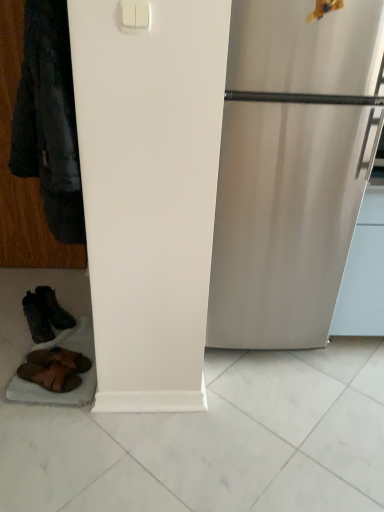
Where is `brown leather sandals at lower left, which ranks as the third footwear in back-to-front order`? The height and width of the screenshot is (512, 384). brown leather sandals at lower left, which ranks as the third footwear in back-to-front order is located at coordinates (50, 376).

Describe the element at coordinates (45, 314) in the screenshot. The height and width of the screenshot is (512, 384). I see `dark brown leather boots at lower left, the 1th footwear viewed from the back` at that location.

Locate an element on the screen. The width and height of the screenshot is (384, 512). brown leather sandals at lower left, which ranks as the second footwear in back-to-front order is located at coordinates (60, 359).

Locate an element on the screen. white plastic light switch at upper center is located at coordinates (135, 14).

Is brown leather sandals at lower left, placed as the first footwear when sorted from front to back, bigger than brown leather sandals at lower left, which ranks as the second footwear in back-to-front order?

Indeed, brown leather sandals at lower left, placed as the first footwear when sorted from front to back, has a larger size compared to brown leather sandals at lower left, which ranks as the second footwear in back-to-front order.

Is brown leather sandals at lower left, placed as the first footwear when sorted from front to back, far from brown leather sandals at lower left, the second footwear from the front?

No, brown leather sandals at lower left, placed as the first footwear when sorted from front to back, is in close proximity to brown leather sandals at lower left, the second footwear from the front.

Which is in front, point (21, 369) or point (43, 354)?

Point (21, 369)

From the image's perspective, relative to brown leather sandals at lower left, the second footwear from the front, is brown leather sandals at lower left, which ranks as the third footwear in back-to-front order, above or below?

Based on their image positions, brown leather sandals at lower left, which ranks as the third footwear in back-to-front order, is located beneath brown leather sandals at lower left, the second footwear from the front.

Does brown leather sandals at lower left, the second footwear from the front, have a lesser width compared to brown leather sandals at lower left, placed as the first footwear when sorted from front to back?

Yes, brown leather sandals at lower left, the second footwear from the front, is thinner than brown leather sandals at lower left, placed as the first footwear when sorted from front to back.

Considering their positions, is brown leather sandals at lower left, which ranks as the second footwear in back-to-front order, located in front of or behind brown leather sandals at lower left, which ranks as the third footwear in back-to-front order?

brown leather sandals at lower left, which ranks as the second footwear in back-to-front order, is positioned farther from the viewer than brown leather sandals at lower left, which ranks as the third footwear in back-to-front order.

Is brown leather sandals at lower left, which ranks as the second footwear in back-to-front order, not inside brown leather sandals at lower left, placed as the first footwear when sorted from front to back?

Absolutely, brown leather sandals at lower left, which ranks as the second footwear in back-to-front order, is external to brown leather sandals at lower left, placed as the first footwear when sorted from front to back.

Is brown leather sandals at lower left, the second footwear from the front, oriented towards brown leather sandals at lower left, which ranks as the third footwear in back-to-front order?

No, brown leather sandals at lower left, the second footwear from the front, is not oriented towards brown leather sandals at lower left, which ranks as the third footwear in back-to-front order.

Considering the relative positions of white plastic light switch at upper center and brown leather sandals at lower left, which ranks as the third footwear in back-to-front order, in the image provided, is white plastic light switch at upper center to the right of brown leather sandals at lower left, which ranks as the third footwear in back-to-front order, from the viewer's perspective?

Yes, white plastic light switch at upper center is to the right of brown leather sandals at lower left, which ranks as the third footwear in back-to-front order.

From the image's perspective, is white plastic light switch at upper center positioned above or below brown leather sandals at lower left, placed as the first footwear when sorted from front to back?

From the image's perspective, white plastic light switch at upper center appears above brown leather sandals at lower left, placed as the first footwear when sorted from front to back.

I want to click on light switch above the brown leather sandals at lower left, which ranks as the third footwear in back-to-front order (from the image's perspective), so click(135, 14).

Can brown leather sandals at lower left, which ranks as the third footwear in back-to-front order, be found inside white plastic light switch at upper center?

That's incorrect, brown leather sandals at lower left, which ranks as the third footwear in back-to-front order, is not inside white plastic light switch at upper center.

Would you consider white plastic light switch at upper center to be distant from brown leather sandals at lower left, the second footwear from the front?

Indeed, white plastic light switch at upper center is not near brown leather sandals at lower left, the second footwear from the front.

Does point (137, 11) come farther from viewer compared to point (57, 354)?

No, it is in front of (57, 354).

Is white plastic light switch at upper center oriented towards brown leather sandals at lower left, which ranks as the second footwear in back-to-front order?

No, white plastic light switch at upper center is not aimed at brown leather sandals at lower left, which ranks as the second footwear in back-to-front order.

Can you tell me how much white plastic light switch at upper center and brown leather sandals at lower left, which ranks as the second footwear in back-to-front order, differ in facing direction?

white plastic light switch at upper center and brown leather sandals at lower left, which ranks as the second footwear in back-to-front order, are facing 106 degrees away from each other.

Would you say dark brown leather boots at lower left, the 1th footwear viewed from the back, is outside brown leather sandals at lower left, placed as the first footwear when sorted from front to back?

That's correct, dark brown leather boots at lower left, the 1th footwear viewed from the back, is outside of brown leather sandals at lower left, placed as the first footwear when sorted from front to back.

Would you say dark brown leather boots at lower left, the 1th footwear viewed from the back, is a long distance from brown leather sandals at lower left, which ranks as the third footwear in back-to-front order?

No, dark brown leather boots at lower left, the 1th footwear viewed from the back, is not far from brown leather sandals at lower left, which ranks as the third footwear in back-to-front order.

How different are the orientations of dark brown leather boots at lower left, the 3th footwear from the front, and brown leather sandals at lower left, which ranks as the third footwear in back-to-front order, in degrees?

26.4 degrees.

From the image's perspective, which is below, dark brown leather boots at lower left, the 3th footwear from the front, or brown leather sandals at lower left, placed as the first footwear when sorted from front to back?

From the image's view, brown leather sandals at lower left, placed as the first footwear when sorted from front to back, is below.

In the scene shown: Considering the sizes of white plastic light switch at upper center and dark brown leather boots at lower left, the 1th footwear viewed from the back, in the image, is white plastic light switch at upper center taller or shorter than dark brown leather boots at lower left, the 1th footwear viewed from the back,?

white plastic light switch at upper center is shorter than dark brown leather boots at lower left, the 1th footwear viewed from the back.

Starting from the white plastic light switch at upper center, which footwear is the 3rd one to the left? Please provide its 2D coordinates.

[(45, 314)]

Is dark brown leather boots at lower left, the 3th footwear from the front, not near brown leather sandals at lower left, the second footwear from the front?

No.

Is dark brown leather boots at lower left, the 1th footwear viewed from the back, not within brown leather sandals at lower left, which ranks as the second footwear in back-to-front order?

Indeed, dark brown leather boots at lower left, the 1th footwear viewed from the back, is completely outside brown leather sandals at lower left, which ranks as the second footwear in back-to-front order.

Looking at their sizes, would you say dark brown leather boots at lower left, the 3th footwear from the front, is wider or thinner than brown leather sandals at lower left, the second footwear from the front?

dark brown leather boots at lower left, the 3th footwear from the front, is thinner than brown leather sandals at lower left, the second footwear from the front.

This screenshot has width=384, height=512. There is a brown leather sandals at lower left, placed as the first footwear when sorted from front to back. What are the coordinates of `the 1st footwear above it (from the image's perspective)` in the screenshot? It's located at [x=60, y=359].

Starting from the brown leather sandals at lower left, which ranks as the third footwear in back-to-front order, which footwear is the 1st one behind? Please provide its 2D coordinates.

[(60, 359)]

Which object lies nearer to the anchor point brown leather sandals at lower left, the second footwear from the front, dark brown leather boots at lower left, the 3th footwear from the front, or brown leather sandals at lower left, placed as the first footwear when sorted from front to back?

brown leather sandals at lower left, placed as the first footwear when sorted from front to back, is positioned closer to the anchor brown leather sandals at lower left, the second footwear from the front.

Which object lies further to the anchor point dark brown leather boots at lower left, the 1th footwear viewed from the back, brown leather sandals at lower left, which ranks as the third footwear in back-to-front order, or brown leather sandals at lower left, the second footwear from the front?

Among the two, brown leather sandals at lower left, which ranks as the third footwear in back-to-front order, is located further to dark brown leather boots at lower left, the 1th footwear viewed from the back.

When comparing their distances from white plastic light switch at upper center, does brown leather sandals at lower left, which ranks as the third footwear in back-to-front order, or dark brown leather boots at lower left, the 3th footwear from the front, seem further?

dark brown leather boots at lower left, the 3th footwear from the front, is further to white plastic light switch at upper center.

From the image, which object appears to be nearer to brown leather sandals at lower left, the second footwear from the front, white plastic light switch at upper center or dark brown leather boots at lower left, the 1th footwear viewed from the back?

dark brown leather boots at lower left, the 1th footwear viewed from the back, lies closer to brown leather sandals at lower left, the second footwear from the front, than the other object.

From the image, which object appears to be nearer to white plastic light switch at upper center, dark brown leather boots at lower left, the 1th footwear viewed from the back, or brown leather sandals at lower left, which ranks as the second footwear in back-to-front order?

The object closer to white plastic light switch at upper center is brown leather sandals at lower left, which ranks as the second footwear in back-to-front order.

Based on their spatial positions, is brown leather sandals at lower left, the second footwear from the front, or brown leather sandals at lower left, which ranks as the third footwear in back-to-front order, closer to dark brown leather boots at lower left, the 3th footwear from the front?

brown leather sandals at lower left, the second footwear from the front, is positioned closer to the anchor dark brown leather boots at lower left, the 3th footwear from the front.

Estimate the real-world distances between objects in this image. Which object is further from dark brown leather boots at lower left, the 1th footwear viewed from the back, brown leather sandals at lower left, placed as the first footwear when sorted from front to back, or white plastic light switch at upper center?

white plastic light switch at upper center is further to dark brown leather boots at lower left, the 1th footwear viewed from the back.

Looking at the image, which one is located closer to brown leather sandals at lower left, which ranks as the third footwear in back-to-front order, dark brown leather boots at lower left, the 3th footwear from the front, or brown leather sandals at lower left, which ranks as the second footwear in back-to-front order?

Based on the image, brown leather sandals at lower left, which ranks as the second footwear in back-to-front order, appears to be nearer to brown leather sandals at lower left, which ranks as the third footwear in back-to-front order.

Where is `footwear between brown leather sandals at lower left, which ranks as the third footwear in back-to-front order, and dark brown leather boots at lower left, the 1th footwear viewed from the back, along the z-axis`? The width and height of the screenshot is (384, 512). footwear between brown leather sandals at lower left, which ranks as the third footwear in back-to-front order, and dark brown leather boots at lower left, the 1th footwear viewed from the back, along the z-axis is located at coordinates tap(60, 359).

You are a GUI agent. You are given a task and a screenshot of the screen. Output one action in this format:
    pyautogui.click(x=<x>, y=<y>)
    Task: Click on the footwear between white plastic light switch at upper center and brown leather sandals at lower left, the second footwear from the front, in the vertical direction
    
    Given the screenshot: What is the action you would take?
    pyautogui.click(x=45, y=314)